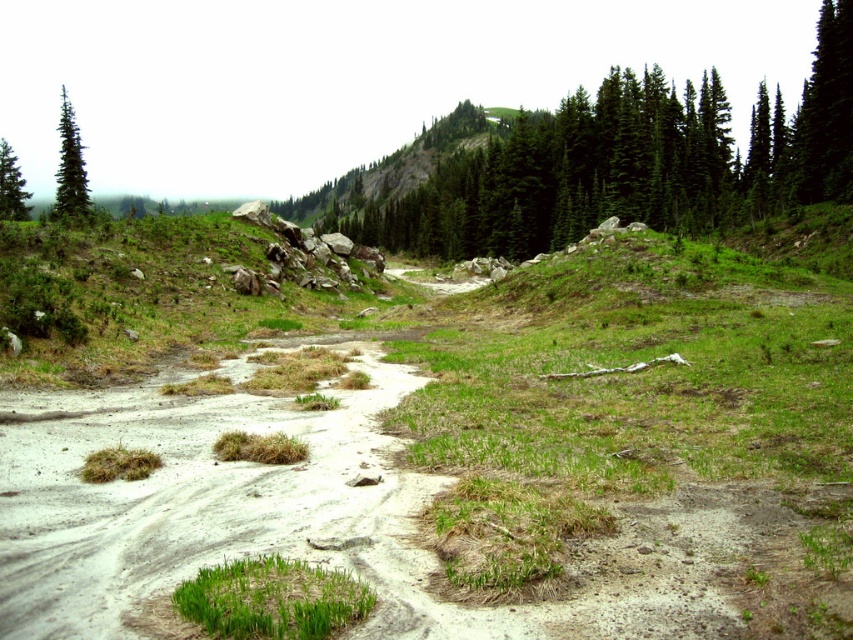
You are a hiker with a 3.5 meter long tent. You want to set up your tent on the green grassy patch at lower center. Can you fit your tent there?

→ The distance between the green grassy patch at lower center and the camera is 8.12 meters. This distance does not provide information about the size of the grassy patch itself, so it is unclear if the tent will fit. Additional details about the patch dimensions are needed.

You are a hiker planning to walk from the green grassy patch at lower center to the green matte evergreen tree at upper left. Which direction should you head to reach the tree?

To reach the green matte evergreen tree at upper left from the green grassy patch at lower center, you should head to the left since the grassy patch is to the right of the tree.

You are a hiker trying to navigate through the rugged landscape. You have two markers, one at point (x=70, y=204) and another at point (x=13, y=180). Which marker is closer to your current position if you are standing at the camera viewpoint?

The point at (x=70, y=204) is closer to the camera viewpoint, so it is the marker closer to your current position.